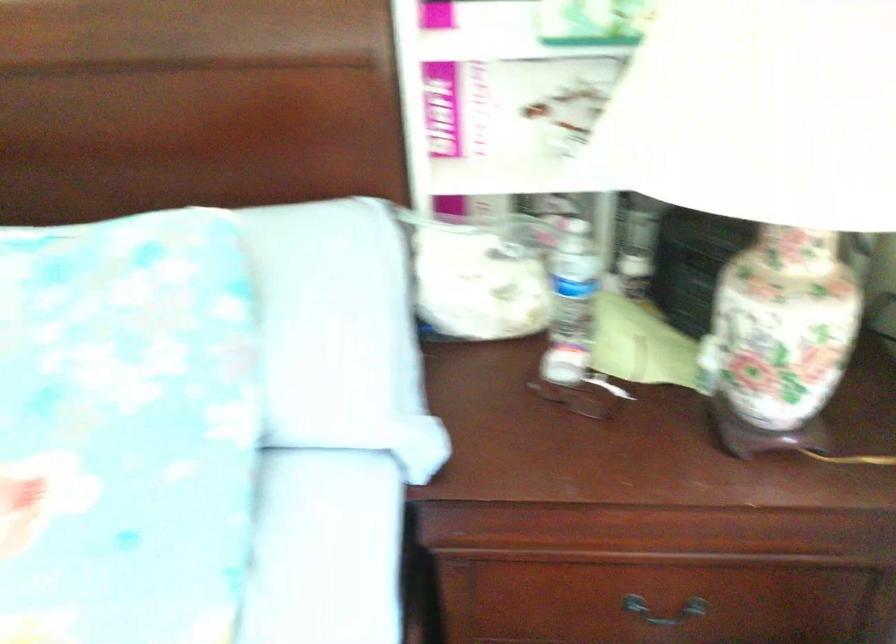
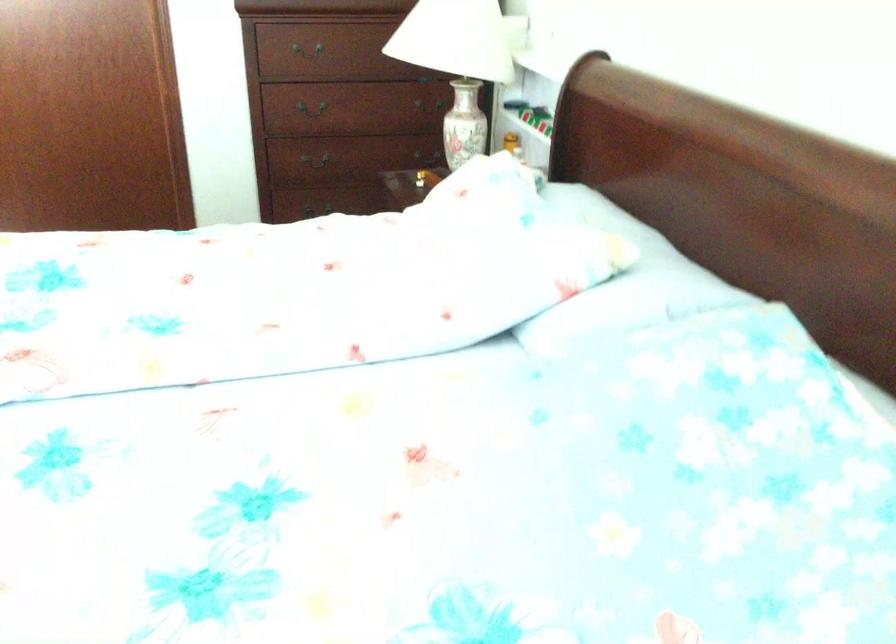
Question: How did the camera likely rotate?

Choices:
 (A) Left
 (B) Right
 (C) Up
 (D) Down

Answer: (A)